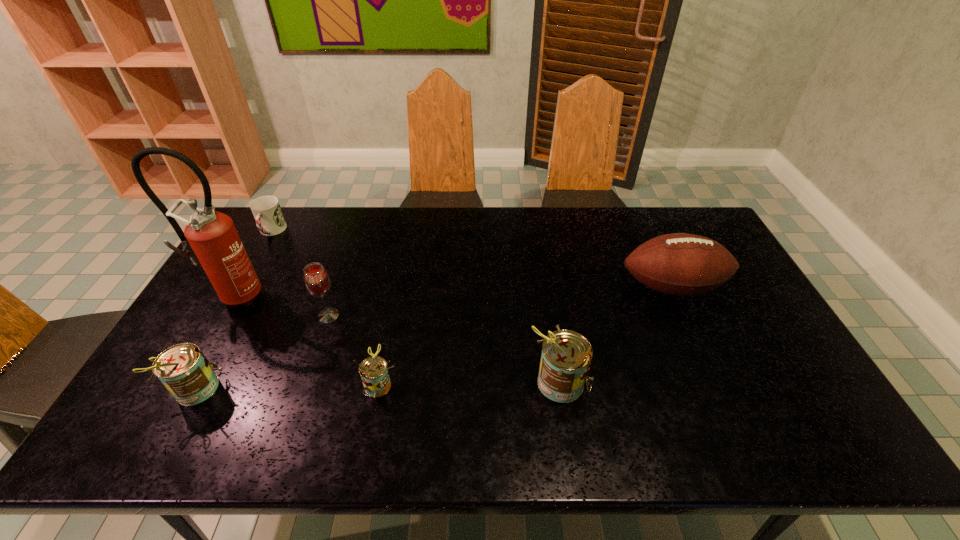
At what (x,y) coordinates should I click in order to perform the action: click on object present at the far left corner. Please return your answer as a coordinate pair (x, y). Looking at the image, I should click on (267, 212).

What are the coordinates of `object at the near left corner` in the screenshot? It's located at (184, 370).

In the image, there is a desktop. Where is `free region at the far edge`? The width and height of the screenshot is (960, 540). free region at the far edge is located at coordinates tap(487, 226).

Identify the location of free point at the near edge. (437, 382).

In the image, there is a desktop. What are the coordinates of `vacant space at the left edge` in the screenshot? It's located at (204, 316).

Where is `vacant space at the right edge of the desktop`? vacant space at the right edge of the desktop is located at coordinates (778, 377).

This screenshot has height=540, width=960. In order to click on free space at the far left corner in this screenshot , I will do `click(297, 214)`.

Where is `blank space at the far right corner of the desktop`? The width and height of the screenshot is (960, 540). blank space at the far right corner of the desktop is located at coordinates (678, 214).

Locate an element on the screen. This screenshot has height=540, width=960. unoccupied position between the fire extinguisher and the wineglass is located at coordinates (282, 306).

At what (x,y) coordinates should I click in order to perform the action: click on unoccupied area between the wineglass and the rightmost can. Please return your answer as a coordinate pair (x, y). Looking at the image, I should click on (444, 349).